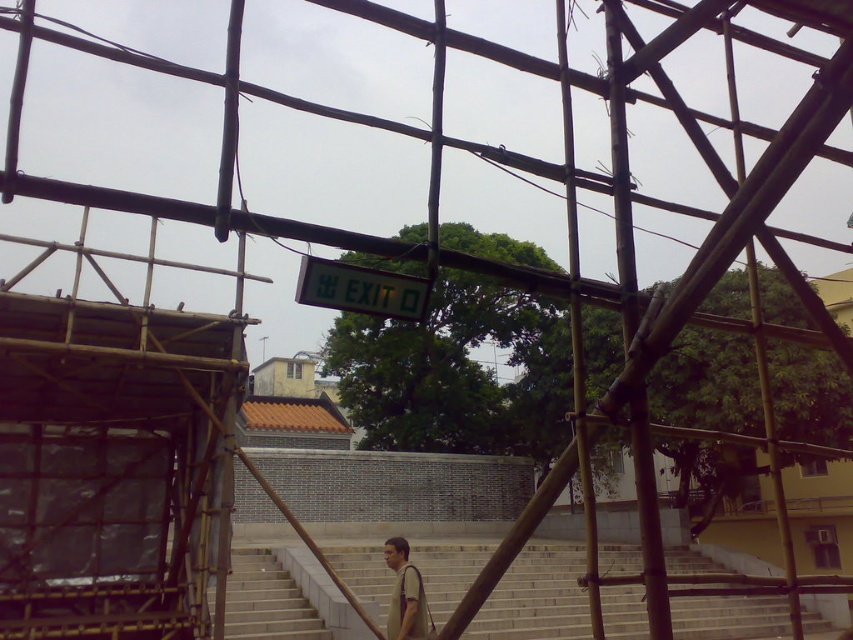
Between light gray concrete stairs at center and light brown fabric shirt at center, which one appears on the right side from the viewer's perspective?

light gray concrete stairs at center

Which is more to the left, light gray concrete stairs at center or light brown fabric shirt at center?

light brown fabric shirt at center is more to the left.

Does point (750, 636) come behind point (422, 618)?

Yes, it is.

Locate an element on the screen. light gray concrete stairs at center is located at coordinates (537, 596).